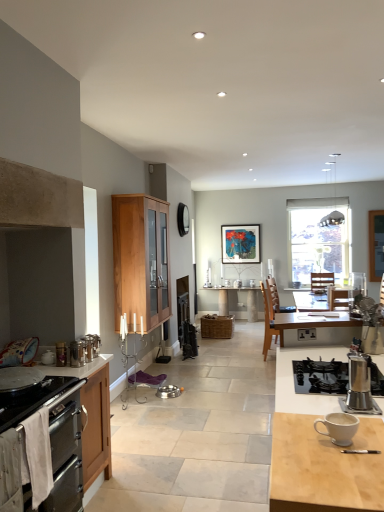
Question: Does metallic stainless steel pet bowls at center, the 2th kitchen appliance from the top, have a lesser height compared to matte black picture frame at center?

Choices:
 (A) no
 (B) yes

Answer: (B)

Question: From a real-world perspective, is metallic stainless steel pet bowls at center, which is the second kitchen appliance from front to back, beneath matte black picture frame at center?

Choices:
 (A) no
 (B) yes

Answer: (B)

Question: Is metallic stainless steel pet bowls at center, which appears as the first kitchen appliance when ordered from the bottom, further to the viewer compared to matte black picture frame at center?

Choices:
 (A) yes
 (B) no

Answer: (B)

Question: Does metallic stainless steel pet bowls at center, which is the 1th kitchen appliance from right to left, appear on the left side of matte black picture frame at center?

Choices:
 (A) yes
 (B) no

Answer: (A)

Question: Is metallic stainless steel pet bowls at center, the second kitchen appliance in the left-to-right sequence, directly adjacent to matte black picture frame at center?

Choices:
 (A) no
 (B) yes

Answer: (A)

Question: From the image's perspective, relative to metallic stainless steel pet bowls at center, the 2th kitchen appliance from the top, is matte white sink at lower left above or below?

Choices:
 (A) below
 (B) above

Answer: (B)

Question: Is matte white sink at lower left spatially inside metallic stainless steel pet bowls at center, which is the second kitchen appliance from front to back, or outside of it?

Choices:
 (A) outside
 (B) inside

Answer: (A)

Question: In terms of size, does matte white sink at lower left appear bigger or smaller than metallic stainless steel pet bowls at center, which is the second kitchen appliance from front to back?

Choices:
 (A) small
 (B) big

Answer: (B)

Question: Considering the positions of matte white sink at lower left and metallic stainless steel pet bowls at center, the second kitchen appliance in the left-to-right sequence, in the image, is matte white sink at lower left wider or thinner than metallic stainless steel pet bowls at center, the second kitchen appliance in the left-to-right sequence,?

Choices:
 (A) wide
 (B) thin

Answer: (B)

Question: From a real-world perspective, is wooden chair at center positioned above or below satin silver coffee maker at lower right?

Choices:
 (A) below
 (B) above

Answer: (A)

Question: Is wooden chair at center to the left or to the right of satin silver coffee maker at lower right in the image?

Choices:
 (A) left
 (B) right

Answer: (B)

Question: From the image's perspective, is wooden chair at center positioned above or below satin silver coffee maker at lower right?

Choices:
 (A) below
 (B) above

Answer: (A)

Question: From their relative heights in the image, would you say wooden chair at center is taller or shorter than satin silver coffee maker at lower right?

Choices:
 (A) short
 (B) tall

Answer: (B)

Question: From a real-world perspective, relative to stainless steel oven at lower left, the 1th cabinetry viewed from the front, is black plastic power outlet at center vertically above or below?

Choices:
 (A) below
 (B) above

Answer: (B)

Question: From their relative heights in the image, would you say black plastic power outlet at center is taller or shorter than stainless steel oven at lower left, the 1th cabinetry positioned from the bottom?

Choices:
 (A) short
 (B) tall

Answer: (A)